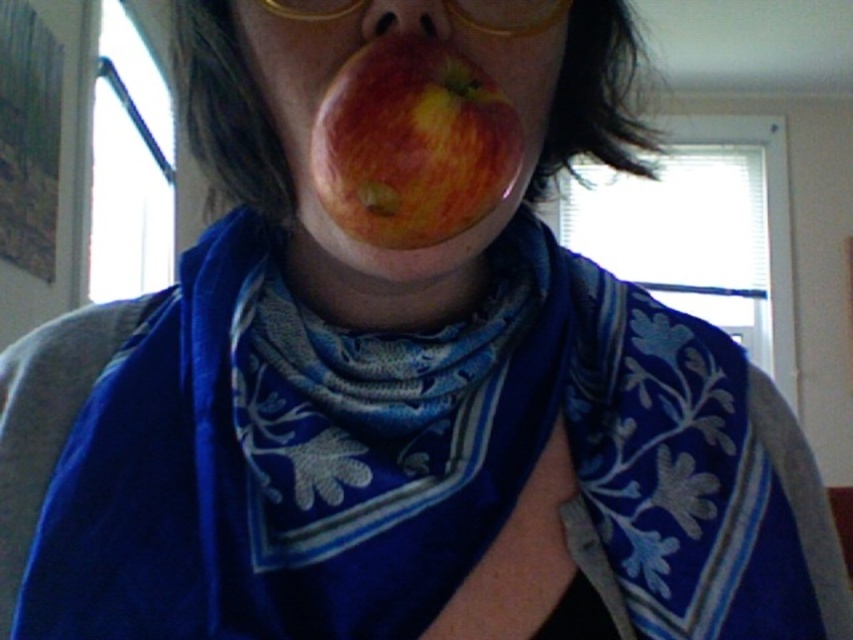
Who is more forward, (x=438, y=148) or (x=297, y=161)?

Positioned in front is point (x=438, y=148).

Looking at this image, between red matte apple at center and shiny red apple at center, which one has less height?

Standing shorter between the two is red matte apple at center.

The width and height of the screenshot is (853, 640). I want to click on red matte apple at center, so click(x=412, y=144).

Is shiny red apple at center further to camera compared to matte plastic nose at center?

Yes, it is.

Is shiny red apple at center bigger than matte plastic nose at center?

Yes.

Which is in front, point (308, 208) or point (387, 12)?

Point (387, 12)

The height and width of the screenshot is (640, 853). In order to click on shiny red apple at center in this screenshot , I will do `click(339, 67)`.

Can you confirm if gold plastic glasses at upper center is positioned to the left of matte plastic nose at center?

No, gold plastic glasses at upper center is not to the left of matte plastic nose at center.

Does gold plastic glasses at upper center lie behind matte plastic nose at center?

Yes, it is behind matte plastic nose at center.

Which is in front, point (543, 12) or point (370, 32)?

Positioned in front is point (370, 32).

Where is `gold plastic glasses at upper center`? gold plastic glasses at upper center is located at coordinates (508, 17).